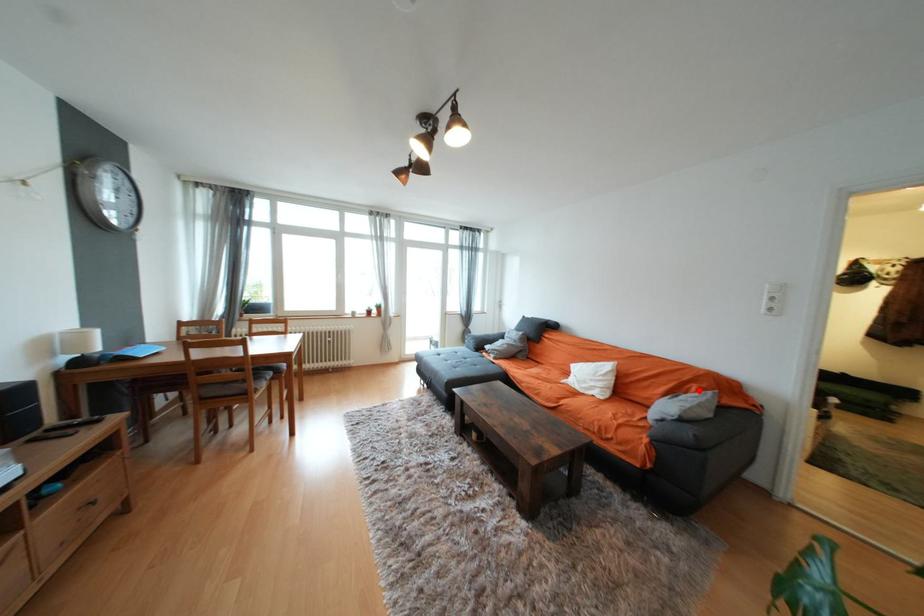
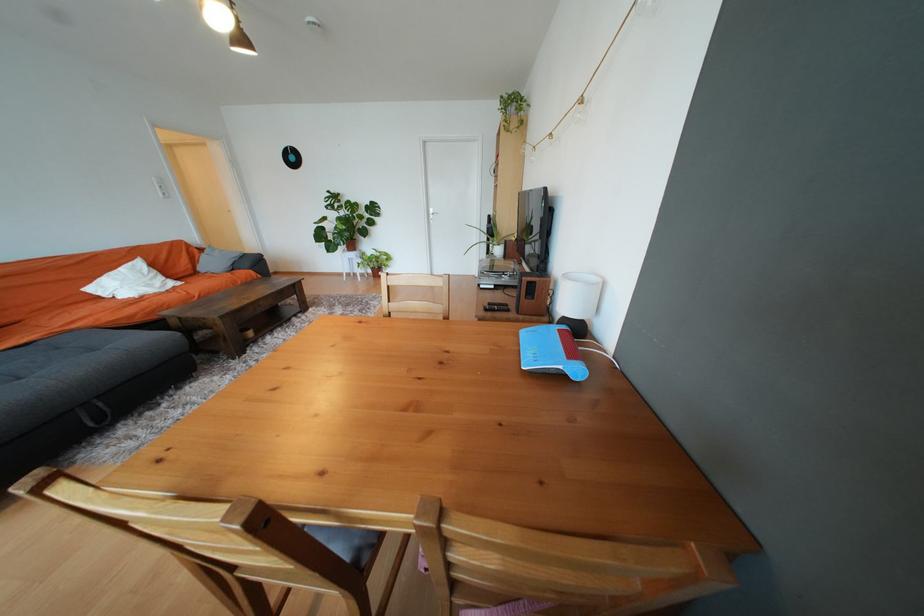
Where in the second image is the point corresponding to the highlighted location from the first image?

(202, 252)